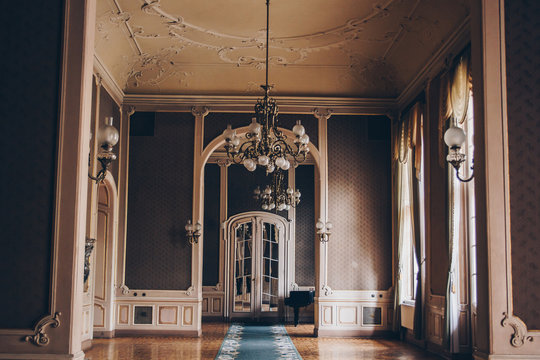
Where is `brown floor`? The width and height of the screenshot is (540, 360). brown floor is located at coordinates (174, 348).